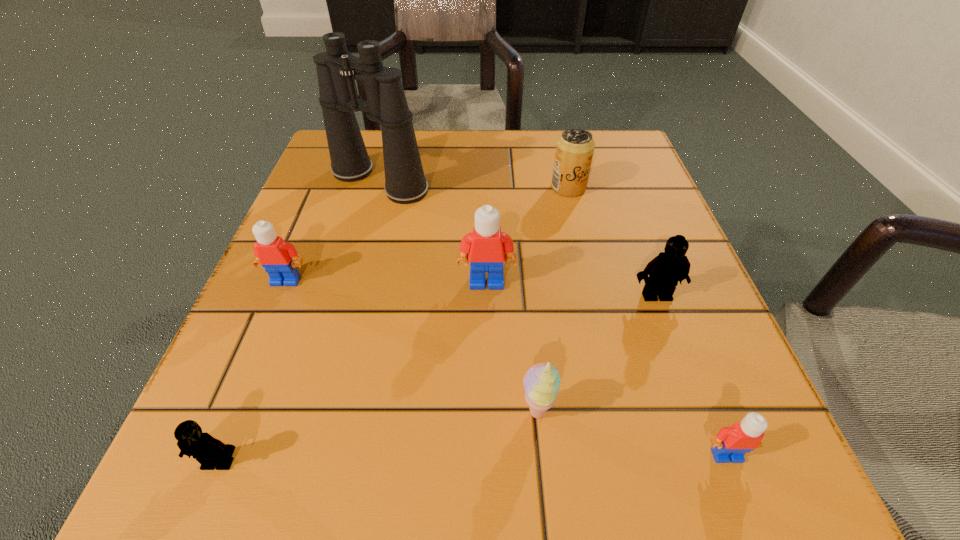
Find the location of `vacant region between the nearer black Lego and the third object from right to left`. vacant region between the nearer black Lego and the third object from right to left is located at coordinates (394, 325).

You are a GUI agent. You are given a task and a screenshot of the screen. Output one action in this format:
    pyautogui.click(x=<x>, y=<y>)
    Task: Click on the fourth closest object relative to the rightmost white Lego
    This screenshot has height=540, width=960.
    Given the screenshot: What is the action you would take?
    pyautogui.click(x=574, y=150)

Locate which object ranks in proximity to the leftmost white Lego. Please provide its 2D coordinates. Your answer should be formatted as a tuple, i.e. [(x, y)], where the tuple contains the x and y coordinates of a point satisfying the conditions above.

[(405, 183)]

Locate which Lego ranks fourth in proximity to the farther black Lego. Please provide its 2D coordinates. Your answer should be formatted as a tuple, i.e. [(x, y)], where the tuple contains the x and y coordinates of a point satisfying the conditions above.

[(208, 451)]

Point out which Lego is positioned as the fourth nearest to the tallest object. Please provide its 2D coordinates. Your answer should be formatted as a tuple, i.e. [(x, y)], where the tuple contains the x and y coordinates of a point satisfying the conditions above.

[(208, 451)]

Where is `the closest white Lego relative to the bigger black Lego`? Image resolution: width=960 pixels, height=540 pixels. the closest white Lego relative to the bigger black Lego is located at coordinates (486, 249).

Locate which white Lego ranks third in proximity to the sherbert. Please provide its 2D coordinates. Your answer should be formatted as a tuple, i.e. [(x, y)], where the tuple contains the x and y coordinates of a point satisfying the conditions above.

[(274, 254)]

Where is `blank area in the image that satisfies the following two spatial constraints: 1. on the face of the third nearest object; 2. on the right side of the second white Lego from left to right`? blank area in the image that satisfies the following two spatial constraints: 1. on the face of the third nearest object; 2. on the right side of the second white Lego from left to right is located at coordinates (489, 413).